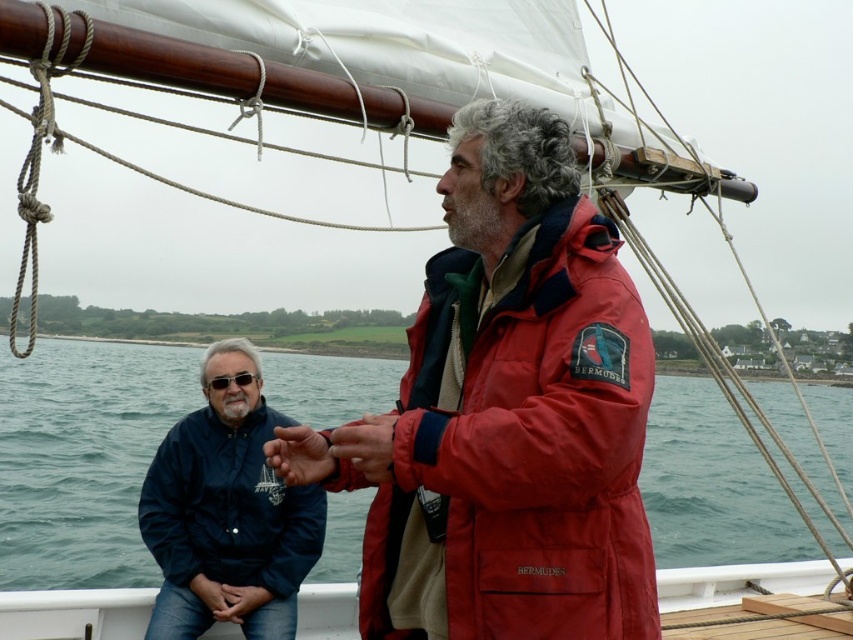
Does red nylon jacket at center appear under matte red glove at center?

Indeed, red nylon jacket at center is positioned under matte red glove at center.

Does point (726, 586) come farther from viewer compared to point (390, 428)?

That is True.

Where is `red nylon jacket at center`? red nylon jacket at center is located at coordinates (740, 589).

Is dark blue jacket at left to the right of smooth skin hand at lower center from the viewer's perspective?

Indeed, dark blue jacket at left is positioned on the right side of smooth skin hand at lower center.

Image resolution: width=853 pixels, height=640 pixels. What do you see at coordinates (227, 506) in the screenshot? I see `dark blue jacket at left` at bounding box center [227, 506].

In order to click on dark blue jacket at left in this screenshot , I will do `click(227, 506)`.

Does red nylon jacket at center appear under smooth skin hand at center?

Yes, red nylon jacket at center is below smooth skin hand at center.

Between point (781, 593) and point (283, 477), which one is positioned in front?

Point (283, 477) is more forward.

Is point (712, 612) positioned behind point (311, 468)?

Yes, point (712, 612) is behind point (311, 468).

At what (x,y) coordinates should I click in order to perform the action: click on red nylon jacket at center. Please return your answer as a coordinate pair (x, y). Looking at the image, I should click on (740, 589).